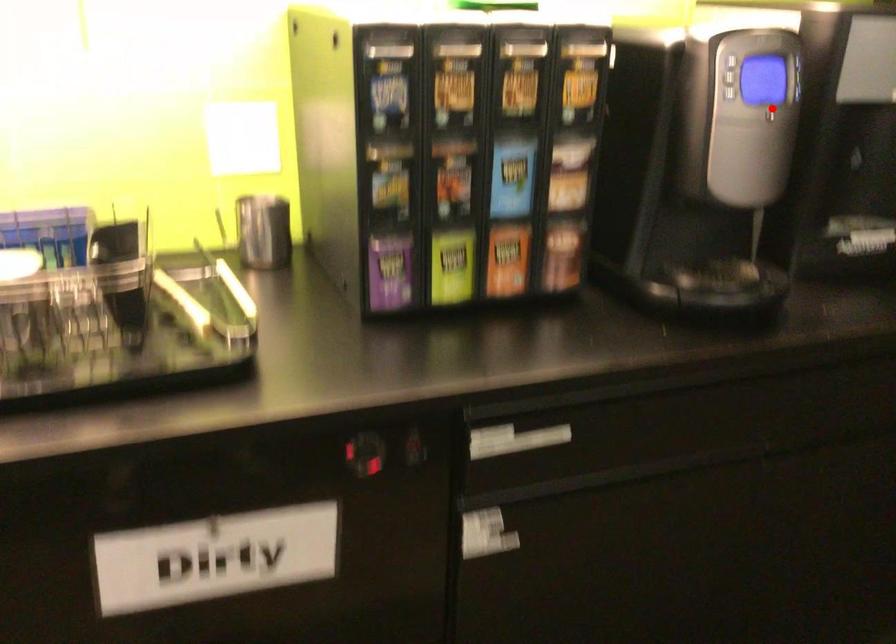
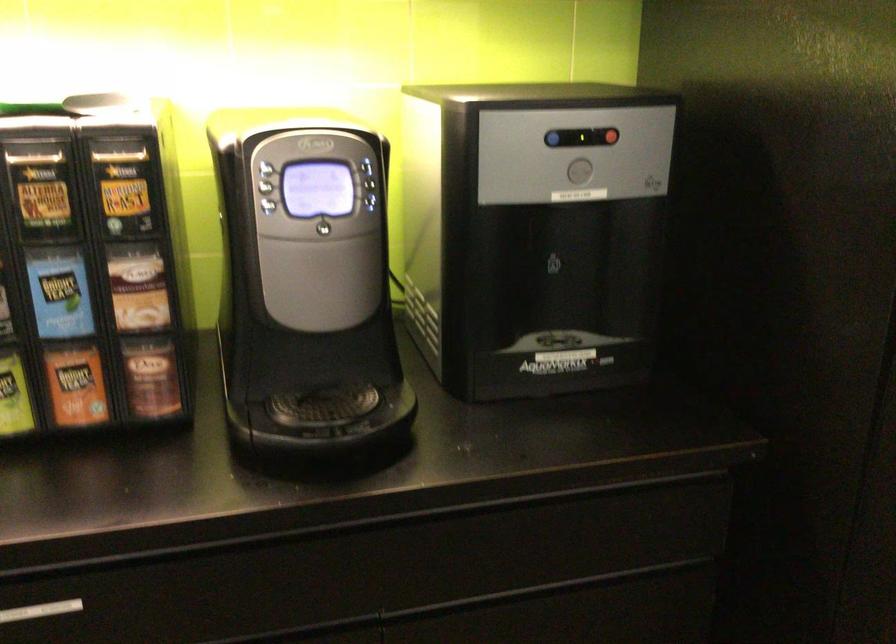
In the second image, find the point that corresponds to the highlighted location in the first image.

(323, 222)